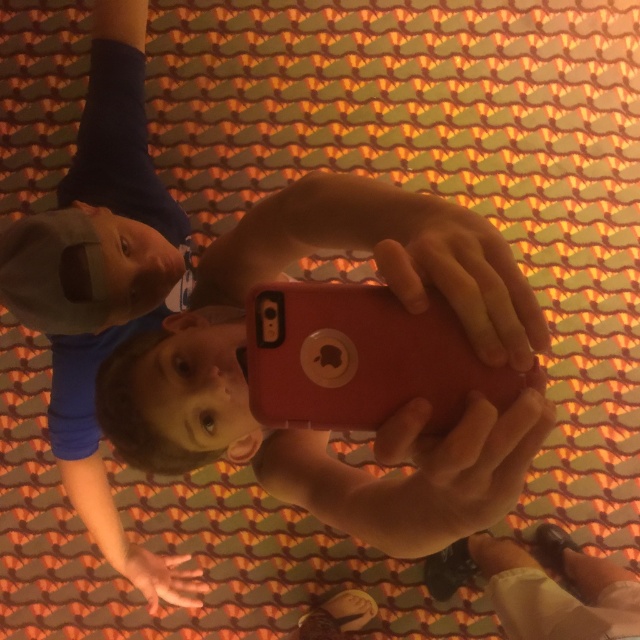
You are a GUI agent. You are given a task and a screenshot of the screen. Output one action in this format:
    pyautogui.click(x=<x>, y=<y>)
    Task: Click on the matte red phone at center
    
    Given the screenshot: What is the action you would take?
    pyautogui.click(x=324, y=432)

Which is more to the left, matte red phone at center or smooth skin at center?

From the viewer's perspective, matte red phone at center appears more on the left side.

At what (x,y) coordinates should I click in order to perform the action: click on matte red phone at center. Please return your answer as a coordinate pair (x, y). Image resolution: width=640 pixels, height=640 pixels. Looking at the image, I should click on (324, 432).

This screenshot has width=640, height=640. I want to click on matte red phone at center, so click(x=324, y=432).

Is matte red phone at center wider than smooth skin hand at center?

Yes.

Who is more distant from viewer, (x=125, y=387) or (x=131, y=573)?

The point (x=131, y=573) is more distant.

Locate an element on the screen. The width and height of the screenshot is (640, 640). matte red phone at center is located at coordinates (324, 432).

You are a GUI agent. You are given a task and a screenshot of the screen. Output one action in this format:
    pyautogui.click(x=<x>, y=<y>)
    Task: Click on the matte red phone at center
    
    Given the screenshot: What is the action you would take?
    pyautogui.click(x=324, y=432)

Who is more distant from viewer, (x=122, y=384) or (x=518, y=403)?

The point (x=122, y=384) is behind.

Is matte red phone at center shorter than matte plastic phone at center?

No, matte red phone at center is not shorter than matte plastic phone at center.

Between point (486, 426) and point (316, 483), which one is positioned behind?

Point (316, 483)

At what (x,y) coordinates should I click in order to perform the action: click on matte red phone at center. Please return your answer as a coordinate pair (x, y). Looking at the image, I should click on (324, 432).